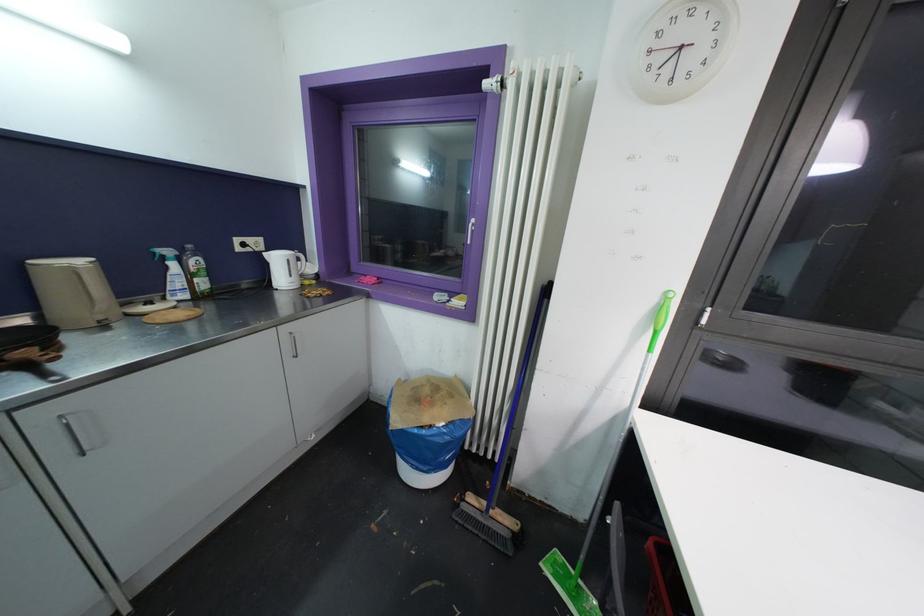
This screenshot has height=616, width=924. Describe the element at coordinates (28, 338) in the screenshot. I see `a black pan handle` at that location.